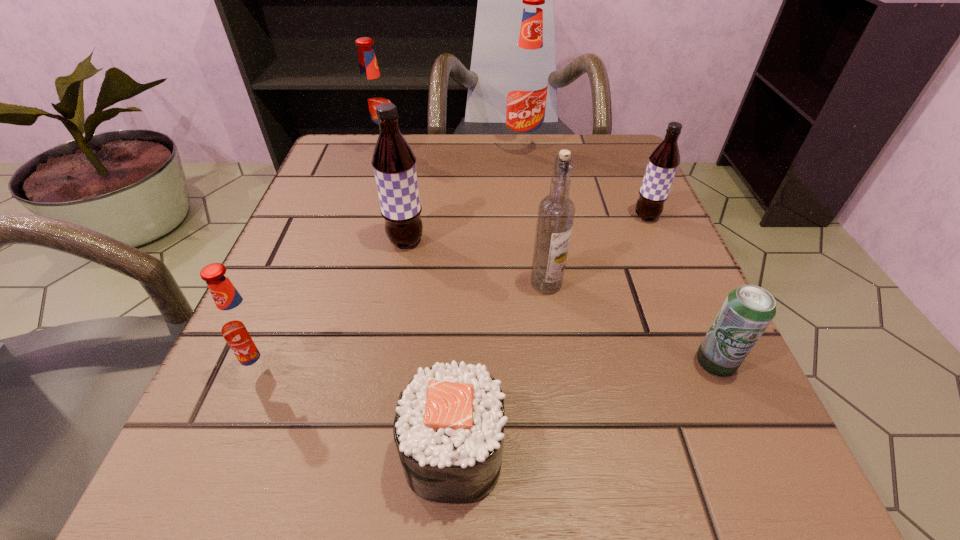
Where is `vacant area between the leftmost root beer and the second biggest red root beer`? This screenshot has height=540, width=960. vacant area between the leftmost root beer and the second biggest red root beer is located at coordinates (325, 262).

Where is `unoccupied position between the vodka and the leftmost root beer`? unoccupied position between the vodka and the leftmost root beer is located at coordinates (407, 326).

I want to click on the closest object to the fourth object from left to right, so (245, 328).

At what (x,y) coordinates should I click in order to perform the action: click on the third closest object relative to the left brown root beer. Please return your answer as a coordinate pair (x, y). This screenshot has width=960, height=540. Looking at the image, I should click on (245, 328).

At what (x,y) coordinates should I click in order to perform the action: click on the fourth closest root beer to the leftmost root beer. Please return your answer as a coordinate pair (x, y). Looking at the image, I should click on (663, 162).

Point out which root beer is positioned as the fourth nearest to the beer can. Please provide its 2D coordinates. Your answer should be formatted as a tuple, i.e. [(x, y)], where the tuple contains the x and y coordinates of a point satisfying the conditions above.

[(245, 328)]

Identify the location of the third closest red root beer to the nearest object. This screenshot has width=960, height=540. (527, 86).

You are a GUI agent. You are given a task and a screenshot of the screen. Output one action in this format:
    pyautogui.click(x=<x>, y=<y>)
    Task: Click on the closest red root beer to the second nearest root beer
    Image resolution: width=960 pixels, height=540 pixels.
    Given the screenshot: What is the action you would take?
    tap(372, 93)